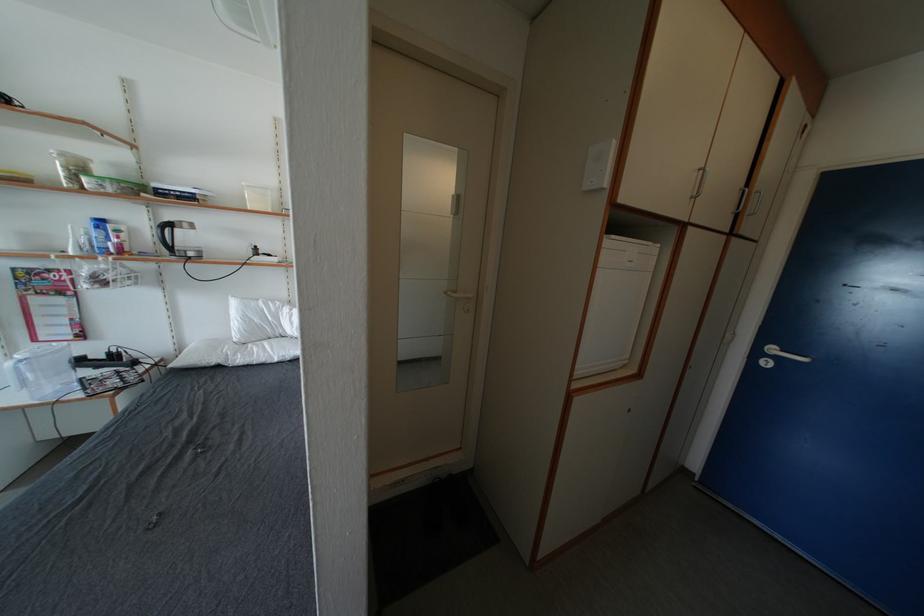
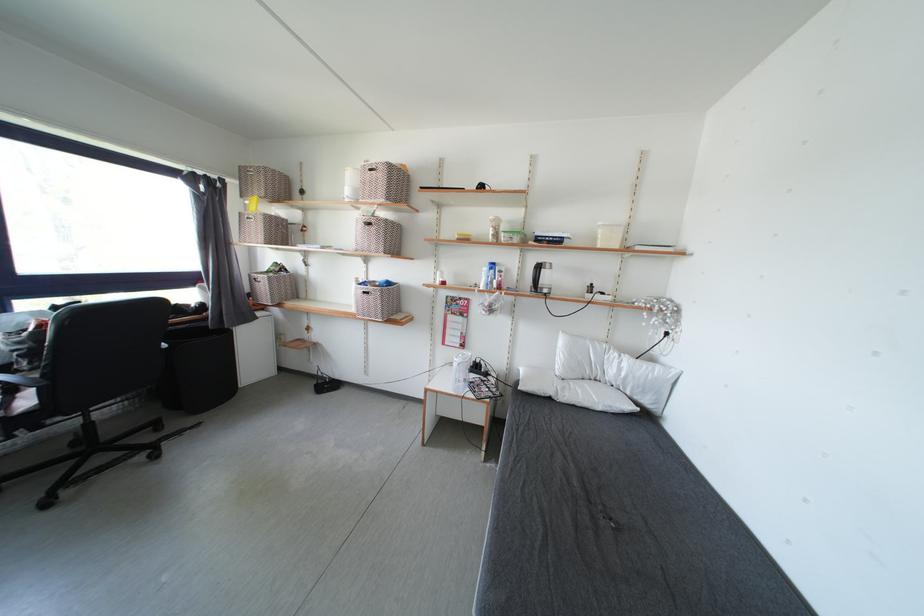
Where in the second image is the point corresponding to (x=238, y=322) from the first image?

(565, 355)